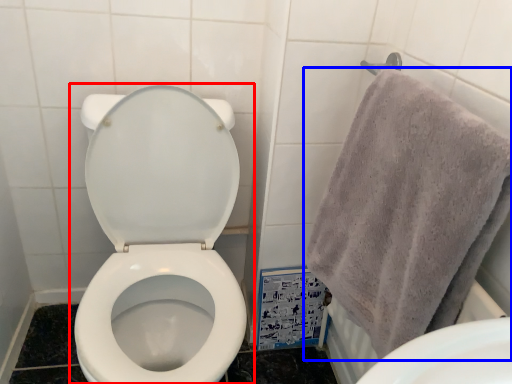
Question: Which object is closer to the camera taking this photo, toilet (highlighted by a red box) or towel (highlighted by a blue box)?

Choices:
 (A) toilet
 (B) towel

Answer: (B)